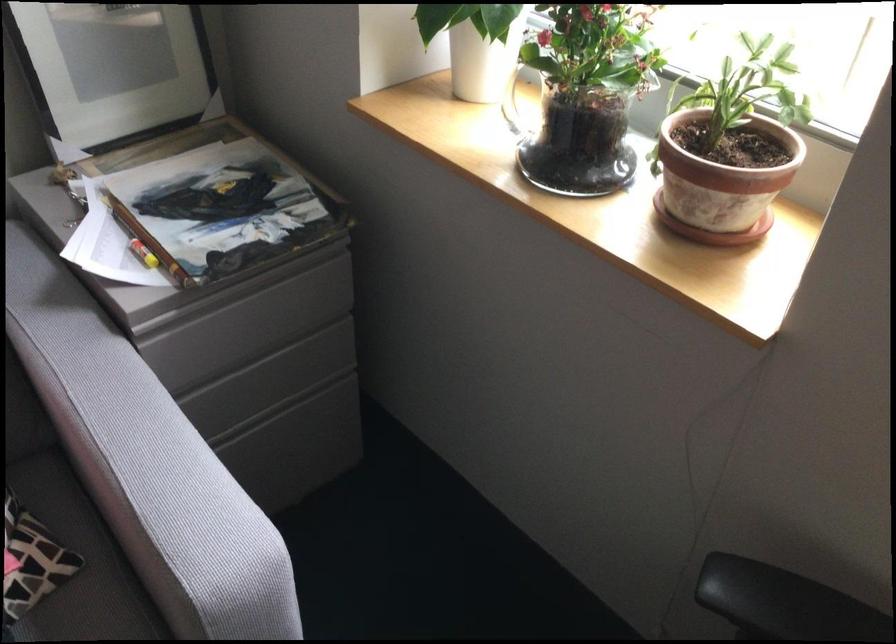
The height and width of the screenshot is (644, 896). Find the location of `grey sofa armrest`. grey sofa armrest is located at coordinates (185, 518).